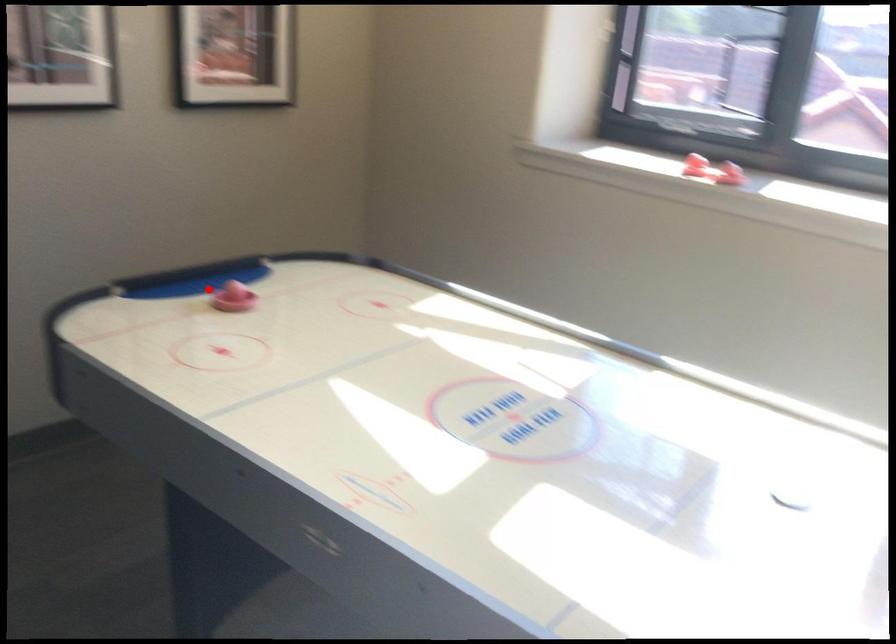
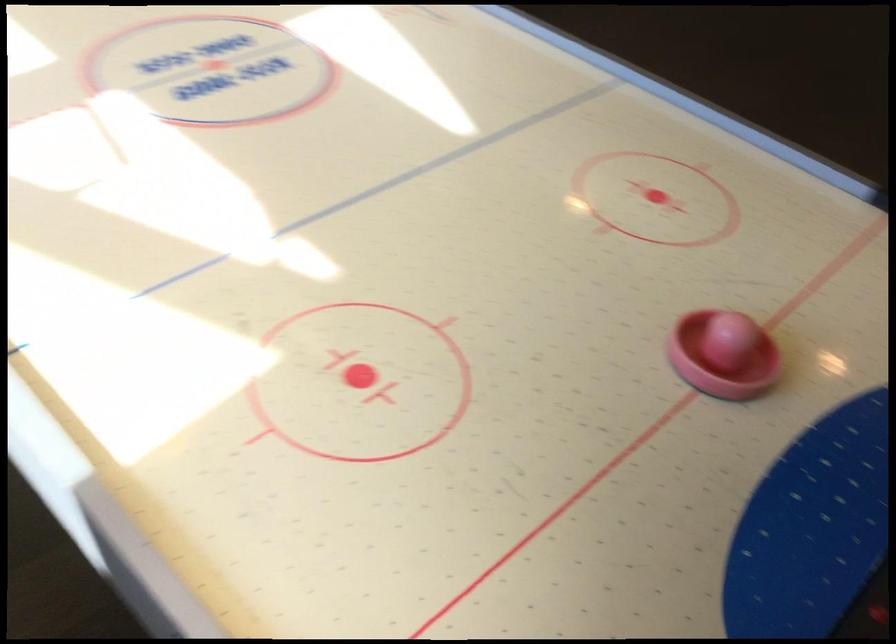
The point at the highlighted location is marked in the first image. Where is the corresponding point in the second image?

(722, 355)